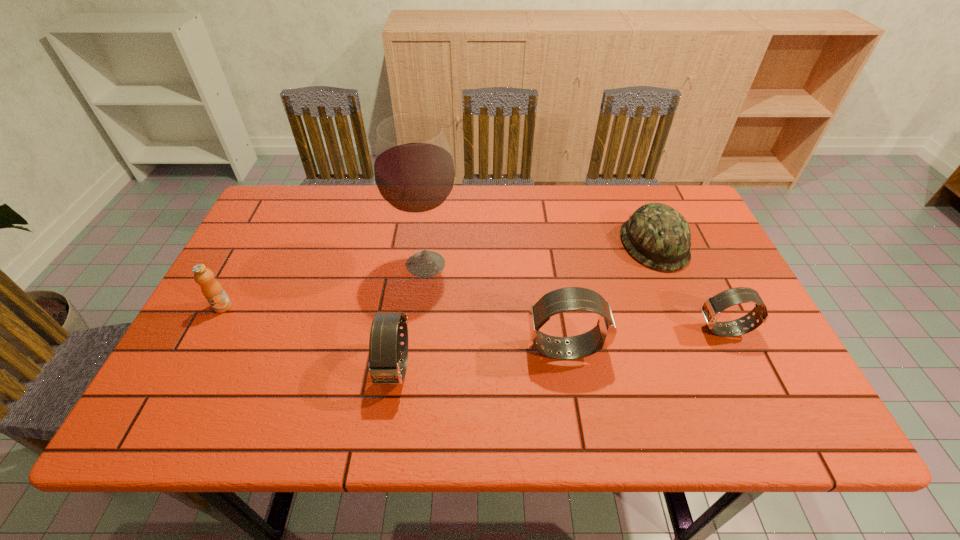
At what (x,y) coordinates should I click in order to perform the action: click on the second shortest watch. Please return your answer as a coordinate pair (x, y). The height and width of the screenshot is (540, 960). Looking at the image, I should click on (385, 347).

Where is `the fourth object from left to right`? the fourth object from left to right is located at coordinates (557, 301).

Where is `the shortest watch`? The width and height of the screenshot is (960, 540). the shortest watch is located at coordinates (712, 307).

Locate an element on the screen. the leftmost object is located at coordinates (212, 290).

Locate an element on the screen. The width and height of the screenshot is (960, 540). orange juice is located at coordinates (212, 290).

Find the location of `headwear`. headwear is located at coordinates (656, 235).

Where is `alcohol`? The height and width of the screenshot is (540, 960). alcohol is located at coordinates (414, 172).

In order to click on free location located 0.090m on the face of the second watch from right to left in this screenshot , I will do `click(644, 348)`.

This screenshot has height=540, width=960. I want to click on vacant space located on the face of the shortest watch, so click(637, 330).

This screenshot has height=540, width=960. In order to click on free space located 0.260m on the face of the shortest watch in this screenshot , I will do `click(586, 330)`.